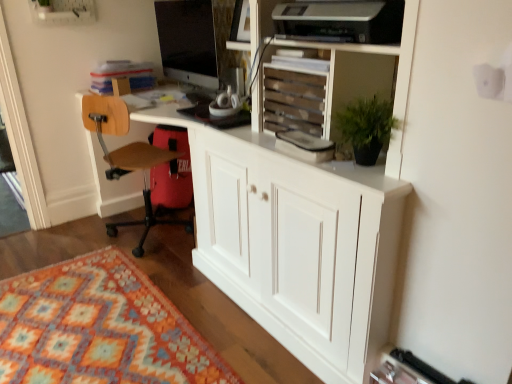
Find the location of a particular element. The width and height of the screenshot is (512, 384). free space that is to the left of brown wood chair at left is located at coordinates (81, 233).